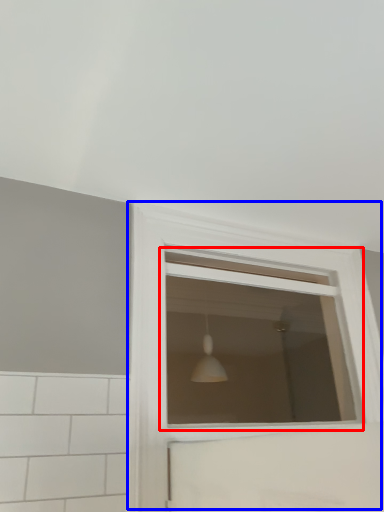
Question: Which object is further to the camera taking this photo, window (highlighted by a red box) or window (highlighted by a blue box)?

Choices:
 (A) window
 (B) window

Answer: (A)